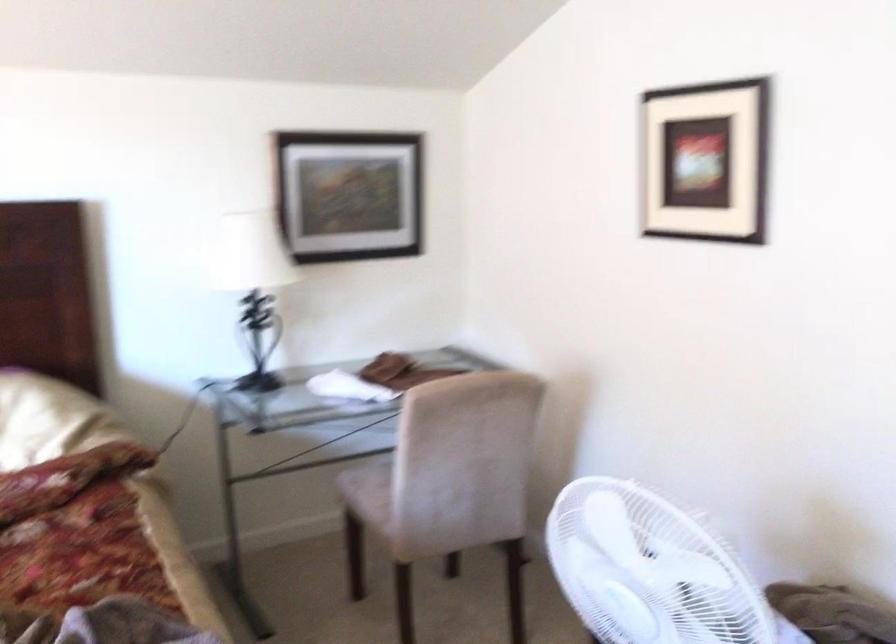
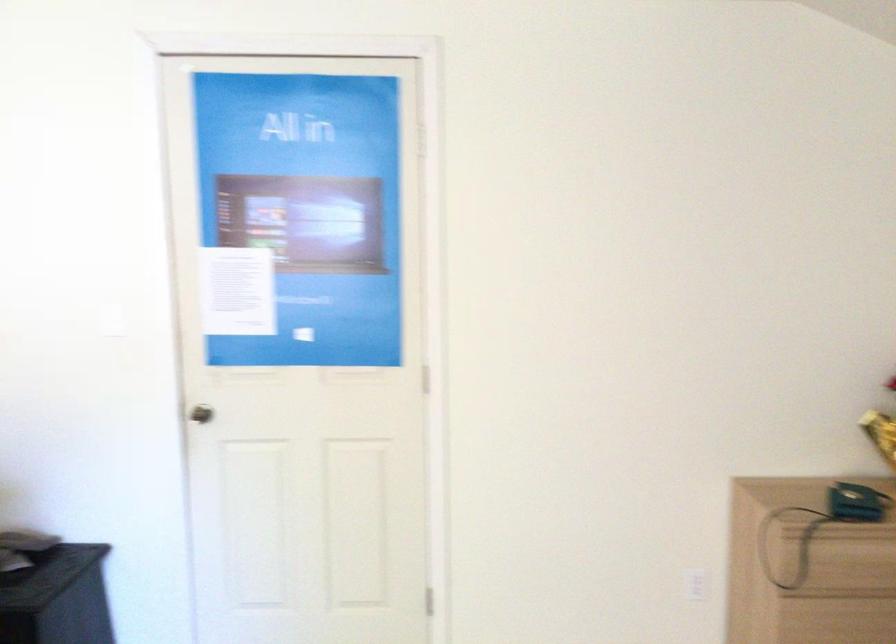
Question: The first image is from the beginning of the video and the second image is from the end. How did the camera likely rotate when shooting the video?

Choices:
 (A) Left
 (B) Right
 (C) Up
 (D) Down

Answer: (B)